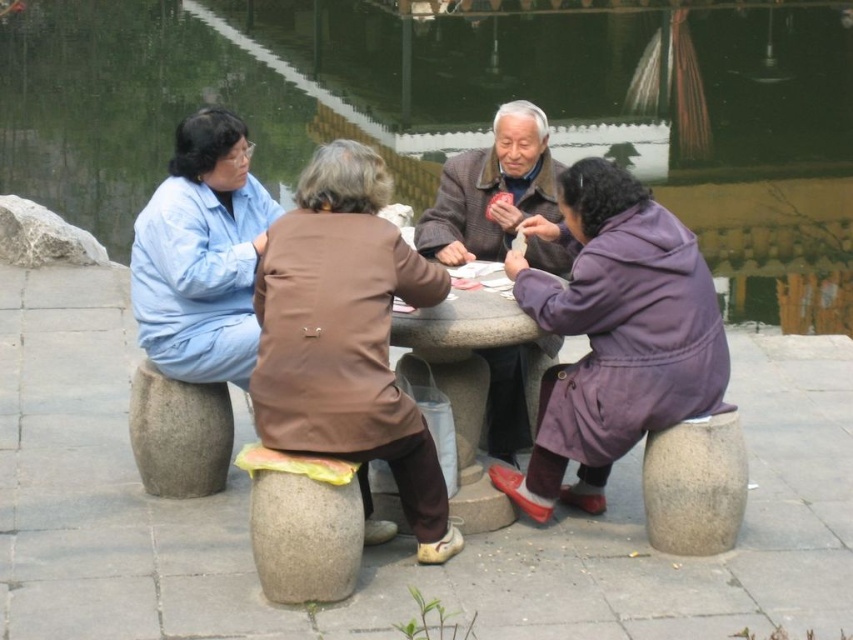
You are standing in front of the round stone table in the park scene. You notice two points marked on the table surface. The first point is at coordinate (407, 483) and the second is at (502, 122). If you were to place a small coin on each point, which coin would appear closer to you?

The point at coordinate (407, 483) is closer to the camera than the point at (502, 122), so the coin placed there would appear closer to you.

You are a photographer trying to capture a group photo of the light blue fabric at left and the brown woolen coat at center. Since you want to include both subjects in the frame, which direction should you position yourself relative to the subjects to ensure both are visible?

You should position yourself to the right of the subjects because the light blue fabric at left is on the left side of the brown woolen coat at center. By standing to the right, both subjects will be visible in the frame.

You are a photographer trying to capture a photo of the purple woolen coat at lower right and the light blue fabric at left. Based on their positions, which object is closer to the bottom edge of the image?

The purple woolen coat at lower right is located below the light blue fabric at left, so it is closer to the bottom edge of the image.